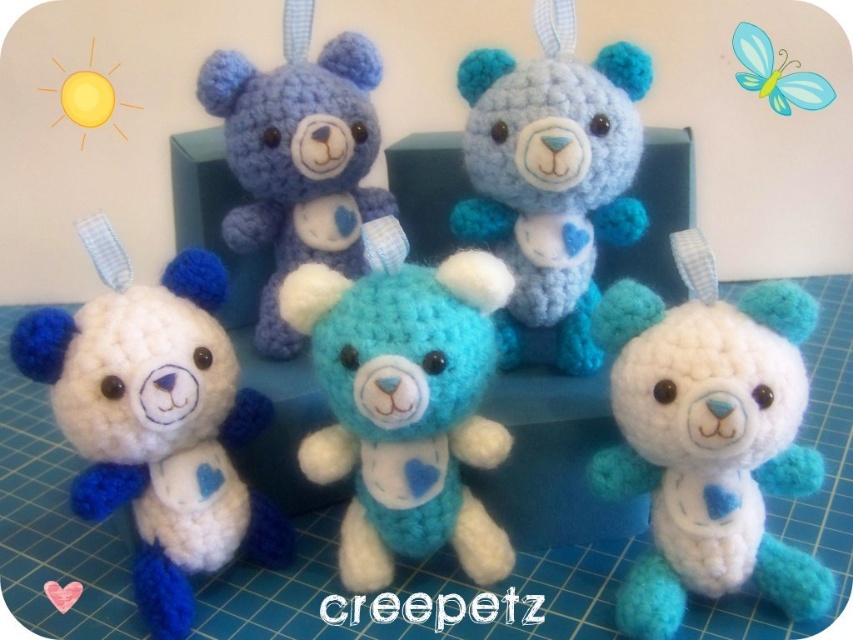
Question: Which object appears farthest from the camera in this image?

Choices:
 (A) teal yarn teddy bear at center
 (B) blue yarn teddy bear at upper center

Answer: (A)

Question: Which point is closer to the camera?

Choices:
 (A) (167, 404)
 (B) (228, 221)

Answer: (A)

Question: Is white yarn teddy bear at center below turquoise yarn teddy bear at center?

Choices:
 (A) no
 (B) yes

Answer: (B)

Question: In this image, where is white yarn teddy bear at center located relative to white yarn teddy bear at lower left?

Choices:
 (A) left
 (B) right

Answer: (B)

Question: Which point is closer to the camera taking this photo?

Choices:
 (A) (612, 81)
 (B) (254, 528)
 (C) (631, 621)
 (D) (221, 72)

Answer: (C)

Question: Does white yarn teddy bear at lower left appear on the right side of blue yarn teddy bear at upper center?

Choices:
 (A) no
 (B) yes

Answer: (A)